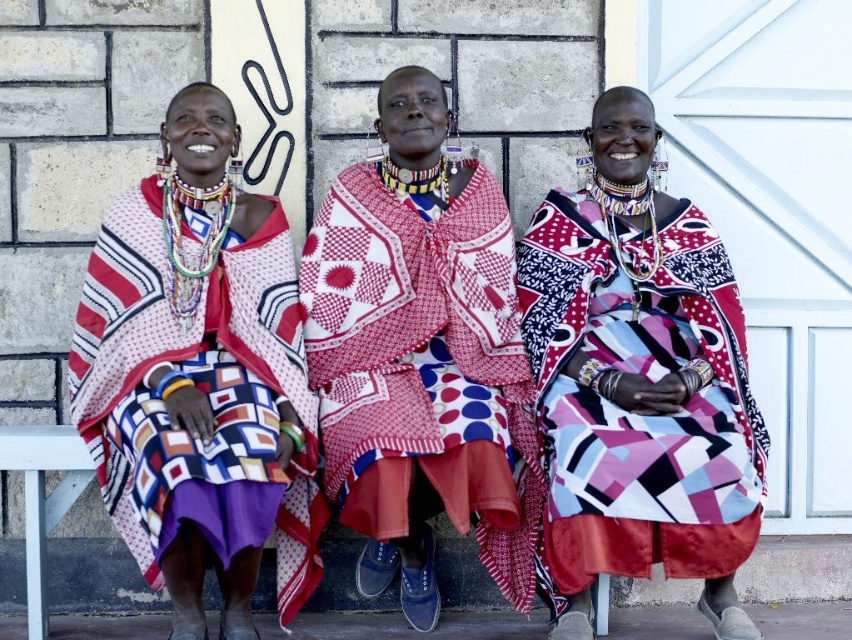
Can you confirm if patterned fabric dress at center is positioned above geometric-patterned fabric at center?

Correct, patterned fabric dress at center is located above geometric-patterned fabric at center.

Between patterned fabric dress at center and geometric-patterned fabric at center, which one appears on the right side from the viewer's perspective?

Positioned to the right is geometric-patterned fabric at center.

Where is `patterned fabric dress at center`? This screenshot has height=640, width=852. patterned fabric dress at center is located at coordinates (419, 355).

Does point (376, 353) come in front of point (167, 280)?

No, (376, 353) is further to viewer.

Does patterned fabric dress at center have a lesser height compared to geometric-patterned fabric at left?

In fact, patterned fabric dress at center may be taller than geometric-patterned fabric at left.

Locate an element on the screen. patterned fabric dress at center is located at coordinates (419, 355).

Does geometric-patterned fabric at center have a smaller size compared to geometric-patterned fabric at left?

Actually, geometric-patterned fabric at center might be larger than geometric-patterned fabric at left.

In order to click on geometric-patterned fabric at center in this screenshot , I will do `click(643, 380)`.